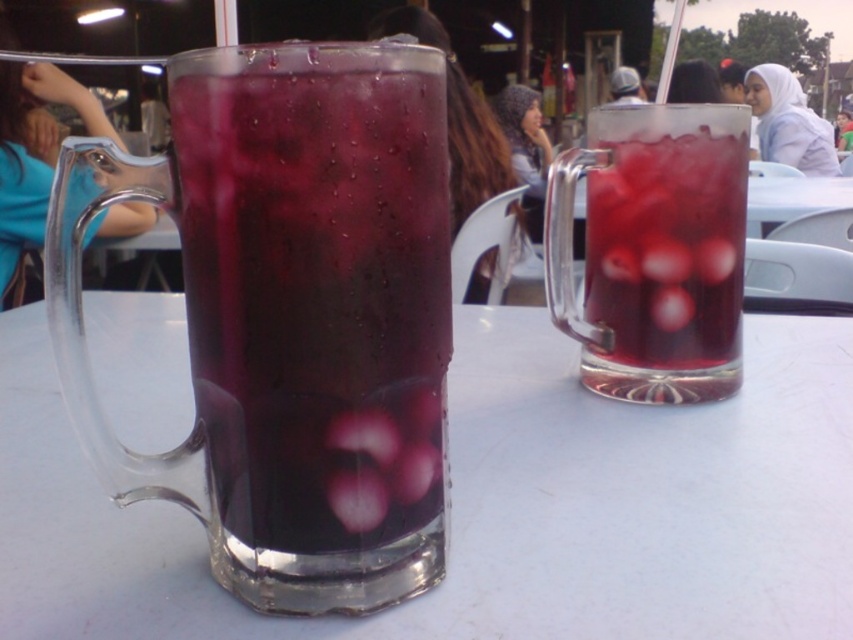
You are sitting at a table in a cafe and notice two mugs in front of you. You want to grab the one that is closer to you. Which one should you choose between the transparent glass mug at center and the translucent glass mug at center?

The transparent glass mug at center is closer to the viewer, so you should choose the transparent glass mug at center.

You are at a cafe and want to order a drink. The barista points to the point at coordinates point (316, 285). What is the color of the glass at that point?

The point (316, 285) is on dark purple glass at left, so the color of the glass at that point is dark purple.

You are at a cafe and want to move your hand between the two dark purple glass at left to pick up the other one. Can you do that without touching either?

The two dark purple glass at left are 6.20 inches apart, so yes, you can move your hand between them without touching either as the space is sufficient.